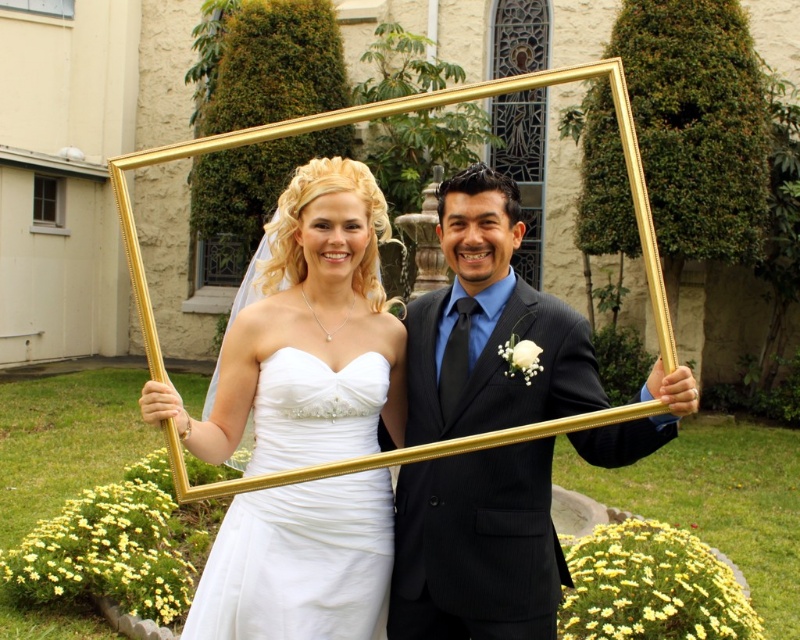
Question: Which object is closer to the camera taking this photo?

Choices:
 (A) white satin wedding dress at center
 (B) gold polished frame at center
 (C) shiny black suit at center

Answer: (C)

Question: Can you confirm if shiny black suit at center is positioned to the right of white satin wedding dress at center?

Choices:
 (A) yes
 (B) no

Answer: (A)

Question: Is the position of matte white dress at center more distant than that of white satin wedding dress at center?

Choices:
 (A) yes
 (B) no

Answer: (B)

Question: Can you confirm if matte white dress at center is positioned to the right of shiny black suit at center?

Choices:
 (A) yes
 (B) no

Answer: (B)

Question: Which object is farther from the camera taking this photo?

Choices:
 (A) gold polished frame at center
 (B) matte white dress at center

Answer: (A)

Question: Which point is farther to the camera?

Choices:
 (A) (385, 516)
 (B) (229, 547)
 (C) (474, 378)
 (D) (544, 81)

Answer: (A)